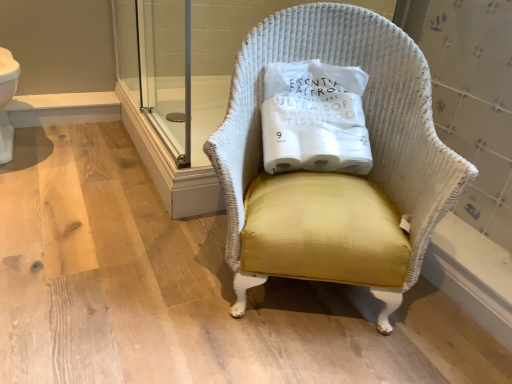
Question: Is white wicker chair at center thinner than yellow fabric pillow at center?

Choices:
 (A) yes
 (B) no

Answer: (B)

Question: From the image's perspective, is white wicker chair at center beneath yellow fabric pillow at center?

Choices:
 (A) yes
 (B) no

Answer: (A)

Question: Does white wicker chair at center have a smaller size compared to yellow fabric pillow at center?

Choices:
 (A) no
 (B) yes

Answer: (A)

Question: Is white wicker chair at center wider than yellow fabric pillow at center?

Choices:
 (A) no
 (B) yes

Answer: (B)

Question: From a real-world perspective, is white wicker chair at center under yellow fabric pillow at center?

Choices:
 (A) yes
 (B) no

Answer: (A)

Question: Is white wicker chair at center positioned beyond the bounds of yellow fabric pillow at center?

Choices:
 (A) yes
 (B) no

Answer: (A)

Question: Is yellow fabric pillow at center wider than white wicker chair at center?

Choices:
 (A) no
 (B) yes

Answer: (A)

Question: Can you confirm if yellow fabric pillow at center is positioned to the right of white wicker chair at center?

Choices:
 (A) yes
 (B) no

Answer: (B)

Question: Does yellow fabric pillow at center turn towards white wicker chair at center?

Choices:
 (A) yes
 (B) no

Answer: (A)

Question: Is yellow fabric pillow at center not within white wicker chair at center?

Choices:
 (A) no
 (B) yes

Answer: (A)

Question: Is yellow fabric pillow at center bigger than white wicker chair at center?

Choices:
 (A) yes
 (B) no

Answer: (B)

Question: From a real-world perspective, is yellow fabric pillow at center positioned under white wicker chair at center based on gravity?

Choices:
 (A) yes
 (B) no

Answer: (B)

Question: From a real-world perspective, relative to yellow fabric pillow at center, is white wicker chair at center vertically above or below?

Choices:
 (A) above
 (B) below

Answer: (B)